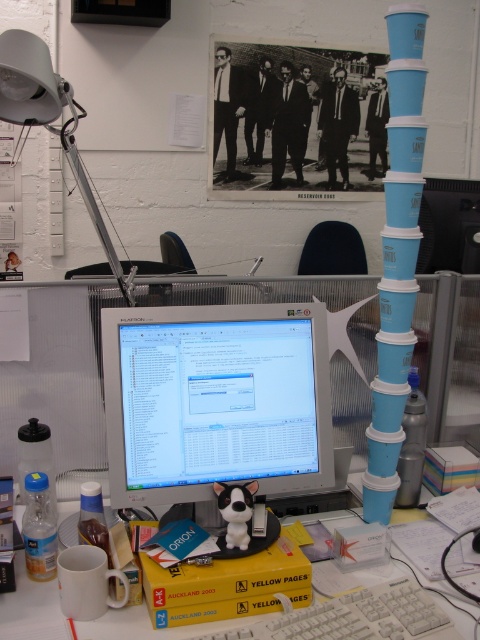
Can you confirm if matte silver monitor at center is positioned above white plastic computer desk at center?

Yes.

Can you confirm if matte silver monitor at center is taller than white plastic computer desk at center?

Correct, matte silver monitor at center is much taller as white plastic computer desk at center.

Where is `matte silver monitor at center`? The height and width of the screenshot is (640, 480). matte silver monitor at center is located at coordinates (216, 400).

What are the coordinates of `matte silver monitor at center` in the screenshot? It's located at (216, 400).

Does white plastic keyboard at center appear over white plastic computer desk at center?

No, white plastic keyboard at center is not above white plastic computer desk at center.

Consider the image. Which is below, white plastic keyboard at center or white plastic computer desk at center?

white plastic keyboard at center is lower down.

Who is more forward, (344,634) or (396,509)?

Positioned in front is point (344,634).

The image size is (480, 640). Identify the location of white plastic keyboard at center. (357, 618).

Who is positioned more to the right, matte silver monitor at center or white plastic keyboard at center?

Positioned to the right is white plastic keyboard at center.

Is matte silver monitor at center shorter than white plastic keyboard at center?

No.

The height and width of the screenshot is (640, 480). In order to click on matte silver monitor at center in this screenshot , I will do `click(216, 400)`.